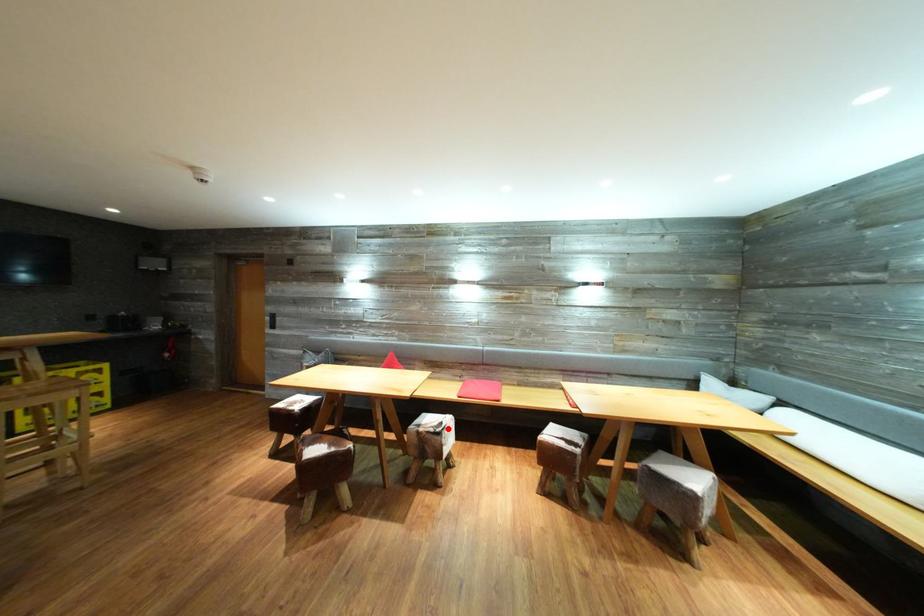
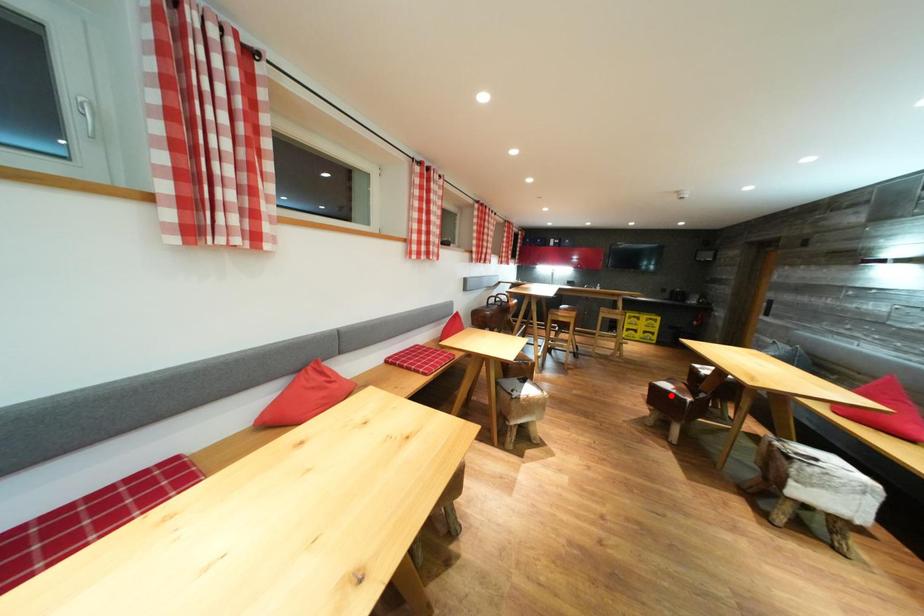
I am providing you with two images of the same scene from different viewpoints. A red point is marked on the first image and another point is marked on the second image. Do the highlighted points in image1 and image2 indicate the same real-world spot?

No